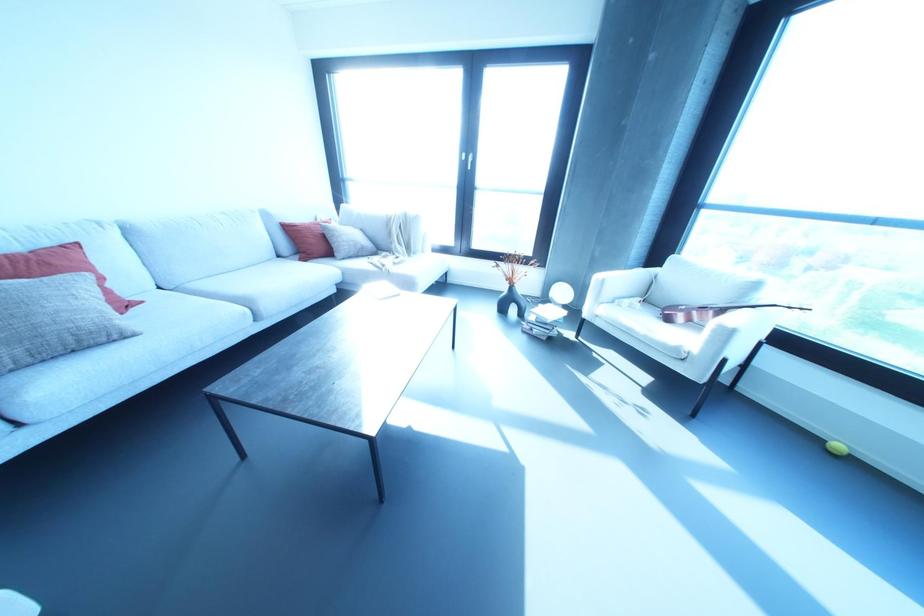
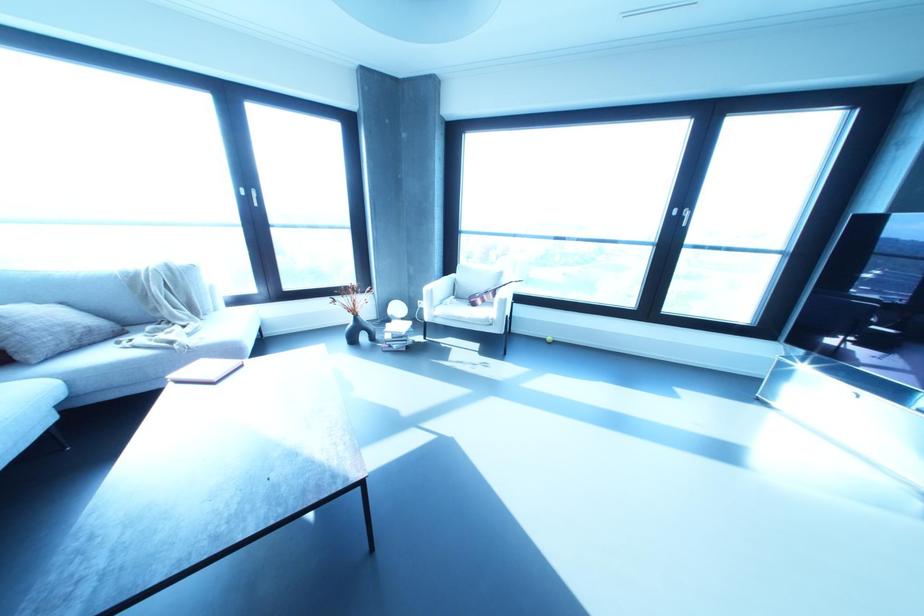
The point at (713, 330) is marked in the first image. Where is the corresponding point in the second image?

(497, 302)